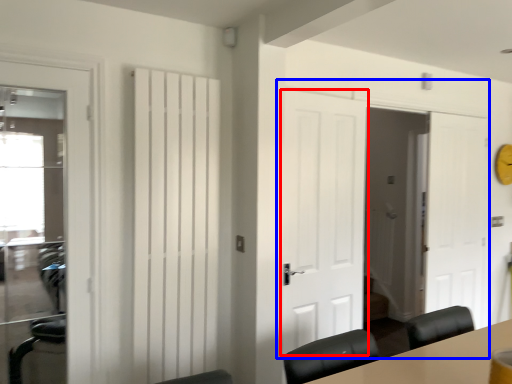
Question: Among these objects, which one is nearest to the camera, door (highlighted by a red box) or door (highlighted by a blue box)?

Choices:
 (A) door
 (B) door

Answer: (A)